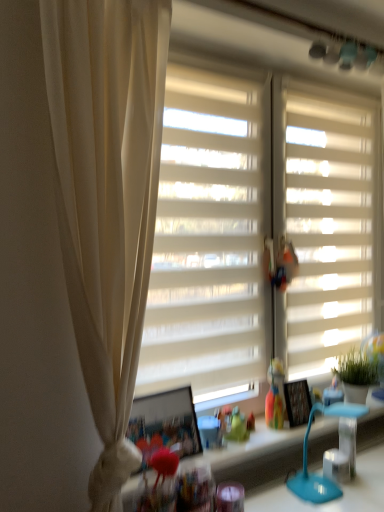
At what (x,y) coordinates should I click in order to perform the action: click on free space above white matte window blind at right (from a real-world perspective). Please return your answer as a coordinate pair (x, y). Image resolution: width=384 pixels, height=512 pixels. Looking at the image, I should click on (333, 90).